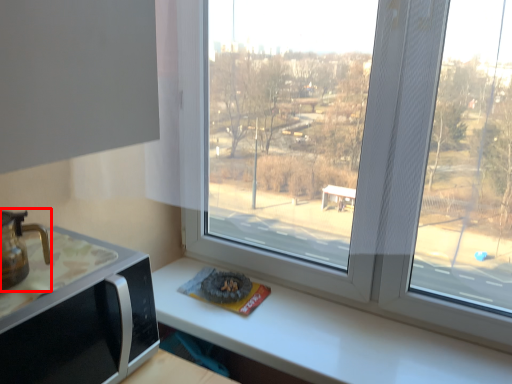
Question: From the image's perspective, considering the relative positions of coffeepot (annotated by the red box) and appliance in the image provided, where is coffeepot (annotated by the red box) located with respect to the staircase?

Choices:
 (A) above
 (B) below

Answer: (A)